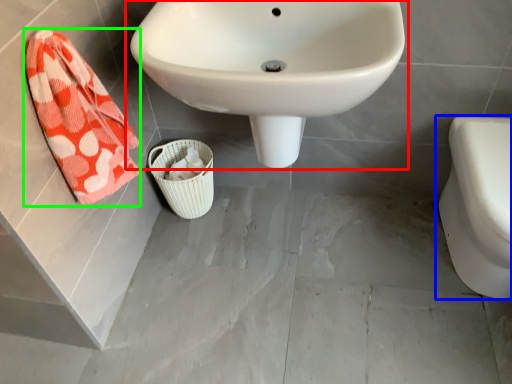
Question: Which object is positioned farthest from sink (highlighted by a red box)? Select from toilet (highlighted by a blue box) and beach towel (highlighted by a green box).

Choices:
 (A) toilet
 (B) beach towel

Answer: (A)